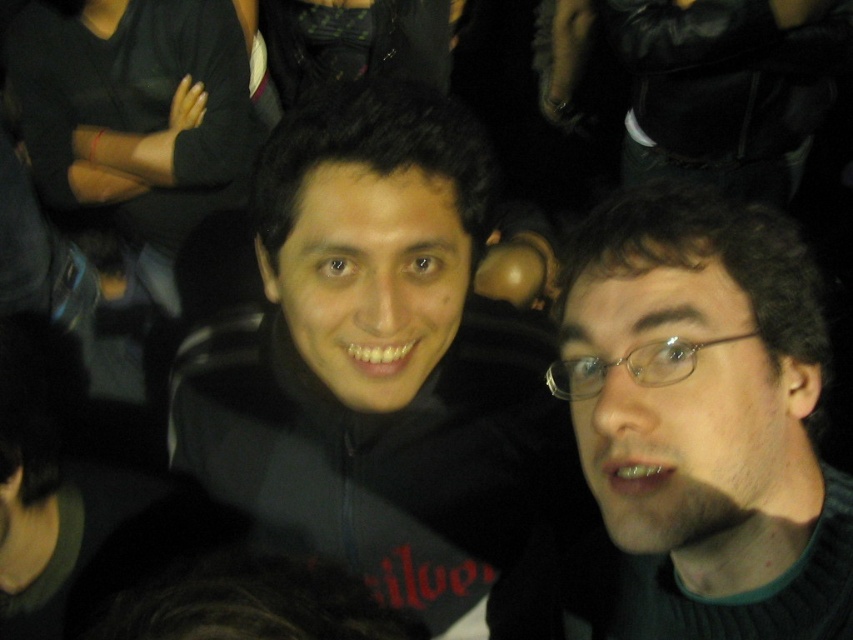
You are at a crowded indoor event and want to locate the black matte jacket at center. Can you confirm if the point at coordinates (380,364) is on the black matte jacket at center?

Yes, the point at coordinates (380,364) is on the black matte jacket at center.

You are at a social event and want to find the person with dark brown hair at right. Which direction should you move from the black matte jacket at center to locate them?

The dark brown hair at right is to the right of the black matte jacket at center, so you should move to the right from the black matte jacket at center to locate them.

You are at a party and need to find the person wearing a black matte jacket at center. Which direction should you look relative to the dark brown hair at right?

The black matte jacket at center is located below the dark brown hair at right, so you should look downward from the dark brown hair at right to find it.